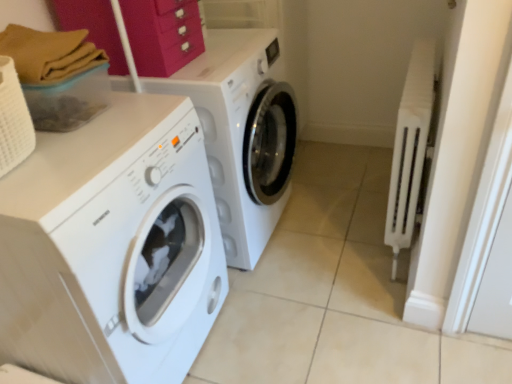
Identify the location of vacant region above white glossy washing machine at center, positioned as the second washing machine in front-to-back order (from a real-world perspective). (221, 54).